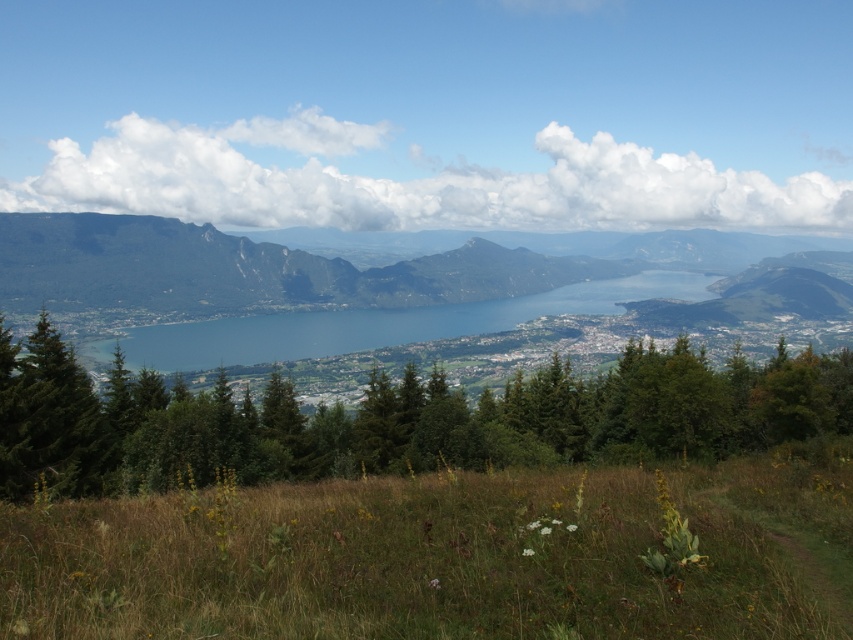
In the scene shown: You are a hiker standing at the edge of the grassy field in the scene. You want to walk directly to the blue water at center but must pass through the green forested mountain at center first. Is this possible given their distance apart?

The green forested mountain at center and blue water at center are 82.02 meters apart. However, since the mountain is between you and the water, you would need to go around it or find a path through it to reach the water, as the distance alone doesn

You are standing in the meadow and want to walk to the blue water at center. Which direction should you go relative to the green leafy trees at center?

You should walk towards the green leafy trees at center because they are located below the blue water at center, so moving towards them will lead you in the direction of the blue water at center.

Looking at this image, you are planning to take a photo of the landscape. You want to ensure that both the green leafy trees at center and the blue water at center are visible in your shot. Given that your camera has a fixed focal length, which object should you focus on to include both in the frame?

Since the green leafy trees at center are narrower than the blue water at center, you should focus on the blue water at center to ensure both fit within the frame.